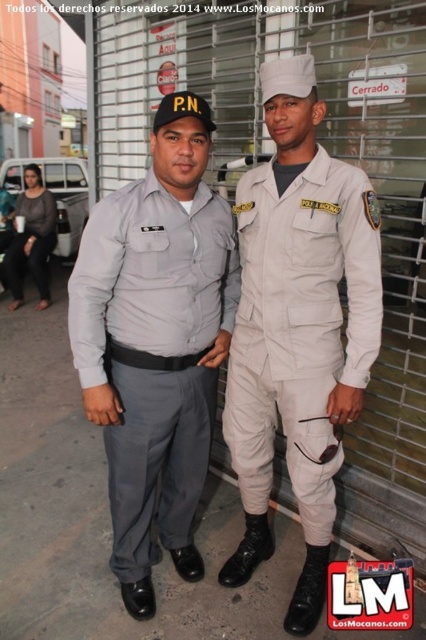
Question: Can you confirm if beige fabric jumpsuit at center is bigger than matte black uniform at left?

Choices:
 (A) yes
 (B) no

Answer: (B)

Question: Does gray fabric shirt at center appear under matte black uniform at left?

Choices:
 (A) no
 (B) yes

Answer: (B)

Question: Which object is the farthest from the beige fabric jumpsuit at center?

Choices:
 (A) matte black uniform at left
 (B) gray fabric shirt at center

Answer: (A)

Question: Which point appears closest to the camera in this image?

Choices:
 (A) (276, 396)
 (B) (161, 275)

Answer: (B)

Question: Among these objects, which one is nearest to the camera?

Choices:
 (A) beige fabric jumpsuit at center
 (B) matte black uniform at left

Answer: (A)

Question: Does beige fabric jumpsuit at center have a greater width compared to matte black uniform at left?

Choices:
 (A) no
 (B) yes

Answer: (A)